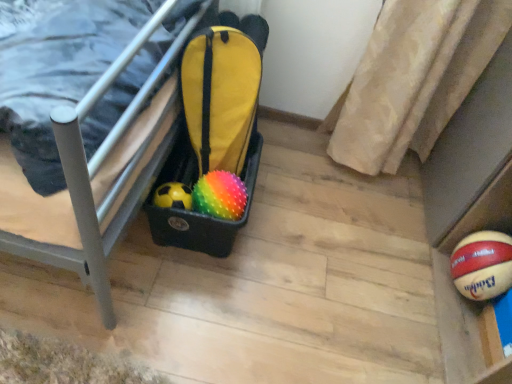
Question: Based on their sizes in the image, would you say black plastic storage bin at lower left is bigger or smaller than spongy multicolored ball at center?

Choices:
 (A) big
 (B) small

Answer: (A)

Question: From a real-world perspective, is black plastic storage bin at lower left positioned above or below spongy multicolored ball at center?

Choices:
 (A) above
 (B) below

Answer: (A)

Question: From their relative heights in the image, would you say black plastic storage bin at lower left is taller or shorter than spongy multicolored ball at center?

Choices:
 (A) tall
 (B) short

Answer: (A)

Question: From the image's perspective, is spongy multicolored ball at center above or below black plastic storage bin at lower left?

Choices:
 (A) below
 (B) above

Answer: (A)

Question: Is spongy multicolored ball at center bigger or smaller than black plastic storage bin at lower left?

Choices:
 (A) big
 (B) small

Answer: (B)

Question: Is point (224, 175) closer or farther from the camera than point (146, 135)?

Choices:
 (A) closer
 (B) farther

Answer: (B)

Question: Relative to black plastic storage bin at lower left, is spongy multicolored ball at center in front or behind?

Choices:
 (A) behind
 (B) front

Answer: (A)